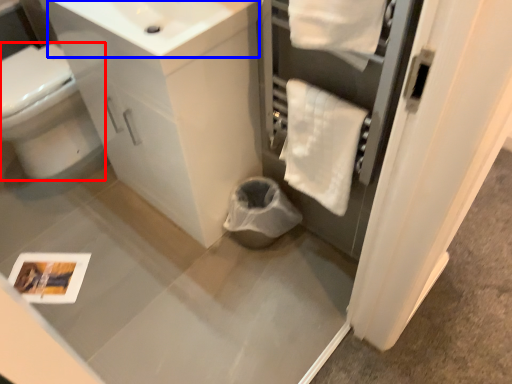
Question: Which point is further to the camera, bidet (highlighted by a red box) or sink (highlighted by a blue box)?

Choices:
 (A) bidet
 (B) sink

Answer: (A)